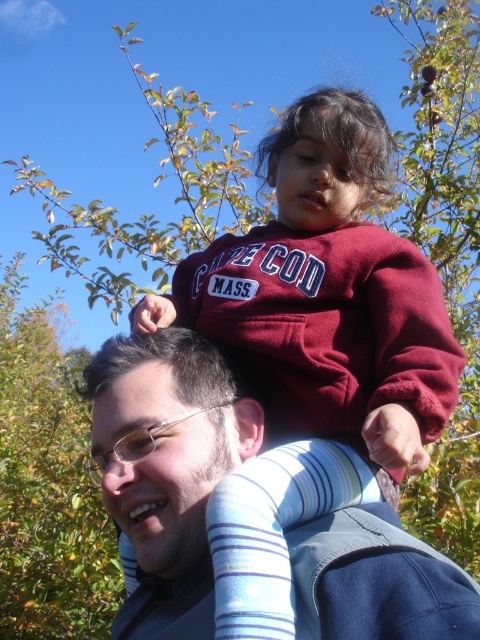
Question: Is maroon fleece at upper center to the right of matte blue shirt at upper center from the viewer's perspective?

Choices:
 (A) yes
 (B) no

Answer: (A)

Question: Does maroon fleece at upper center appear under matte blue shirt at upper center?

Choices:
 (A) no
 (B) yes

Answer: (A)

Question: Among these points, which one is nearest to the camera?

Choices:
 (A) (x=142, y=636)
 (B) (x=424, y=372)

Answer: (B)

Question: In this image, where is maroon fleece at upper center located relative to matte blue shirt at upper center?

Choices:
 (A) below
 (B) above

Answer: (B)

Question: Which object appears farthest from the camera in this image?

Choices:
 (A) maroon fleece at upper center
 (B) matte blue shirt at upper center

Answer: (B)